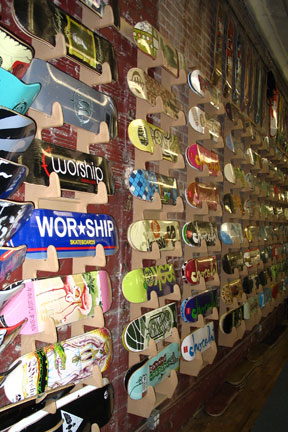
Locate an element on the screen. This screenshot has width=288, height=432. brown brick wall is located at coordinates (183, 12), (206, 9), (206, 49).